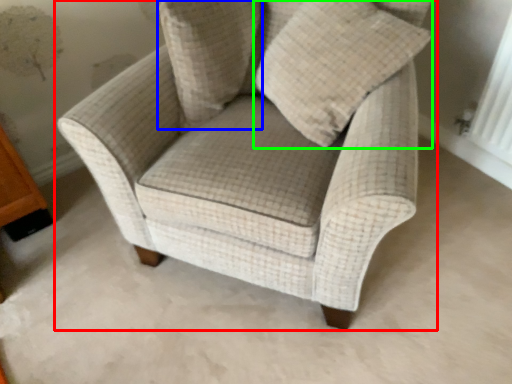
Question: Which object is the closest to the chair (highlighted by a red box)? Choose among these: pillow (highlighted by a blue box) or throw pillow (highlighted by a green box).

Choices:
 (A) pillow
 (B) throw pillow

Answer: (B)